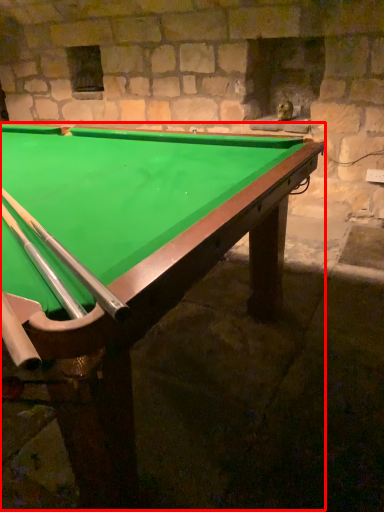
Question: From the image's perspective, what is the correct spatial relationship of billiard table (annotated by the red box) in relation to cue?

Choices:
 (A) above
 (B) below

Answer: (B)